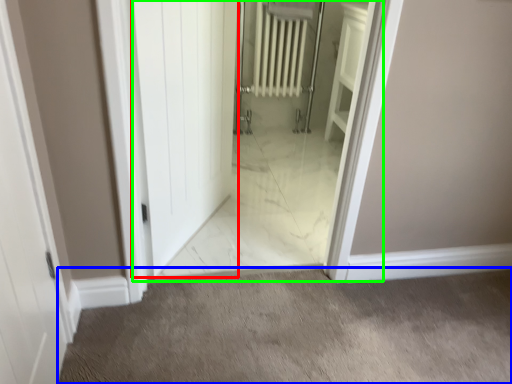
Question: Considering the real-world distances, which object is closest to door (highlighted by a red box)? granite (highlighted by a blue box) or elevator (highlighted by a green box).

Choices:
 (A) granite
 (B) elevator

Answer: (B)